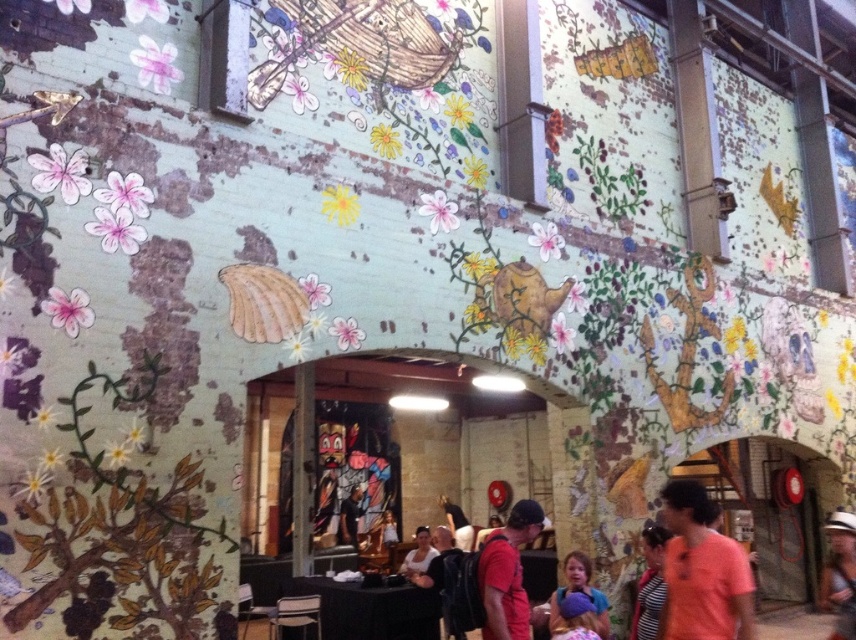
You are an artist standing in front of the mural and want to paint a new design between the matte red shirt at lower center and the smooth white shirt at center. Given their sizes, which shirt will require more paint?

The matte red shirt at lower center is larger in size than the smooth white shirt at center, so it will require more paint.

You are standing in front of the mural and notice the matte pink shirt at center and the white matte hat at lower right. Which object is positioned to the right side of the other?

The white matte hat at lower right is positioned to the right of the matte pink shirt at center.

You are a painter standing in front of the mural and want to place a new sticker between the matte pink shirt at center and the white matte hat at lower right. Which object should you place the sticker closer to if you want the sticker to be closer to the narrower object?

The matte pink shirt at center has a smaller width than the white matte hat at lower right, so you should place the sticker closer to the matte pink shirt at center to be nearer to the narrower object.